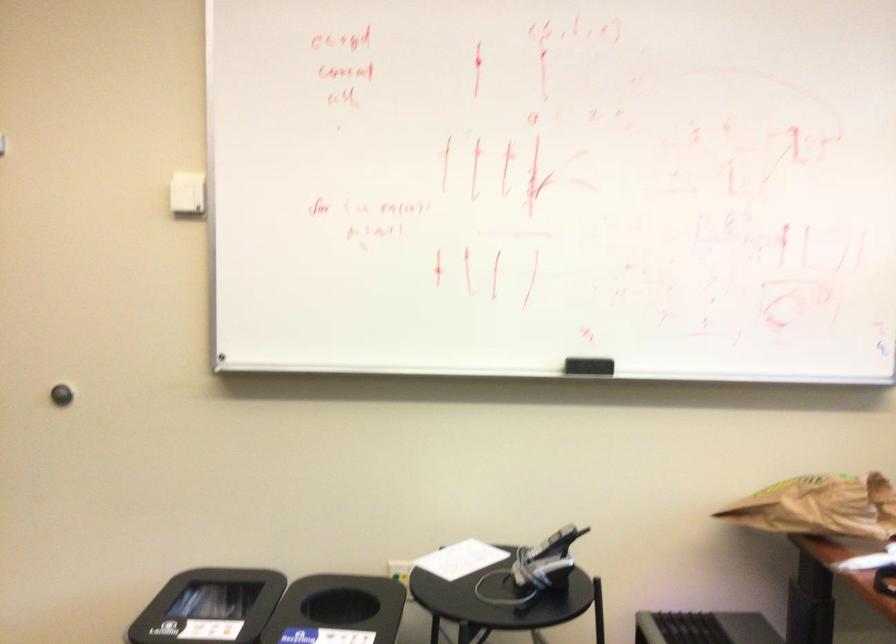
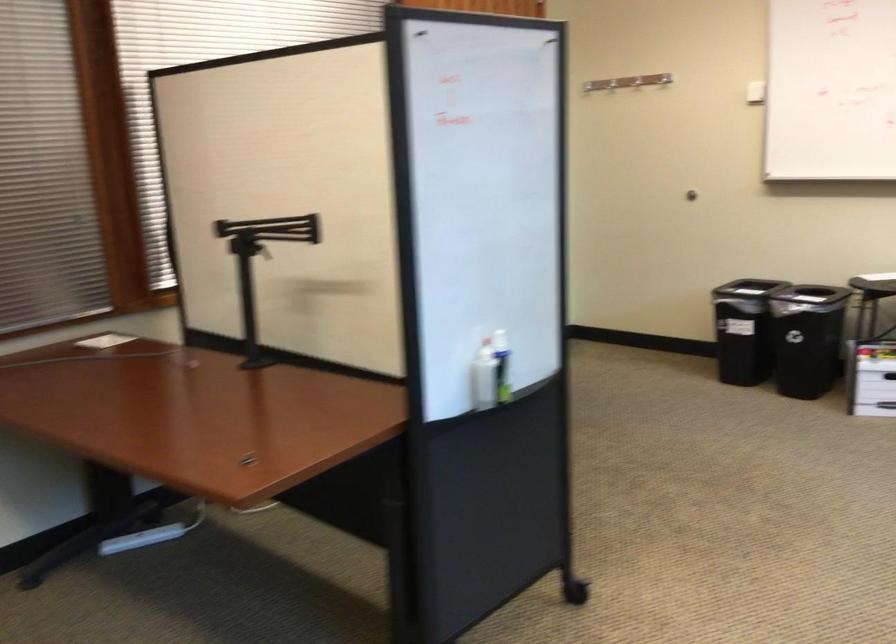
Find the pixel in the second image that matches pixel 179 163 in the first image.

(664, 79)